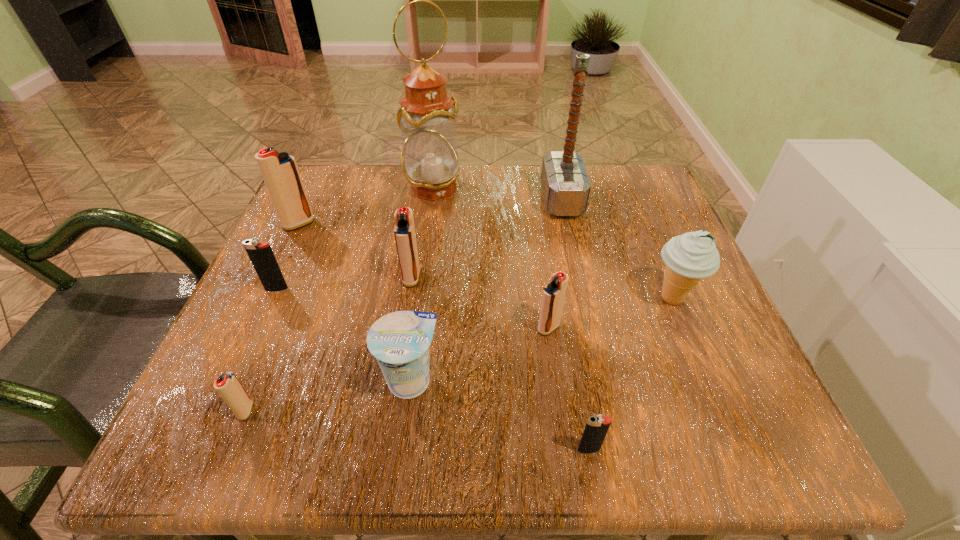
Locate an element on the screen. This screenshot has height=540, width=960. oil lamp present at the far edge is located at coordinates (429, 158).

You are a GUI agent. You are given a task and a screenshot of the screen. Output one action in this format:
    pyautogui.click(x=<x>, y=<y>)
    Task: Click on the hammer that is at the far edge
    This screenshot has width=960, height=540.
    Given the screenshot: What is the action you would take?
    pyautogui.click(x=565, y=184)

You are a GUI agent. You are given a task and a screenshot of the screen. Output one action in this format:
    pyautogui.click(x=<x>, y=<y>)
    Task: Click on the igniter that is at the far edge
    The image size is (960, 540).
    Given the screenshot: What is the action you would take?
    pyautogui.click(x=280, y=172)

Locate an element on the screen. yogurt located at the near edge is located at coordinates (400, 341).

The width and height of the screenshot is (960, 540). I want to click on object that is positioned at the right edge, so click(x=689, y=257).

Identify the location of object that is at the far left corner. (280, 172).

I want to click on object present at the near left corner, so coord(228,386).

Locate an element on the screen. vacant space at the far edge of the desktop is located at coordinates (457, 221).

You are a GUI agent. You are given a task and a screenshot of the screen. Output one action in this format:
    pyautogui.click(x=<x>, y=<y>)
    Task: Click on the free location at the near edge
    
    Given the screenshot: What is the action you would take?
    pyautogui.click(x=438, y=439)

The image size is (960, 540). In the image, there is a desktop. In order to click on vacant area at the left edge in this screenshot , I will do `click(274, 359)`.